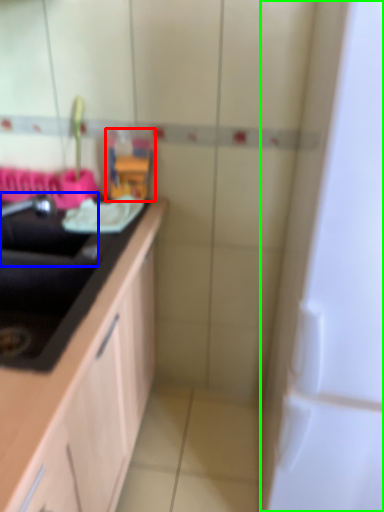
Question: Based on their relative distances, which object is nearer to toy (highlighted by a red box)? Choose from sink (highlighted by a blue box) and appliance (highlighted by a green box).

Choices:
 (A) sink
 (B) appliance

Answer: (A)